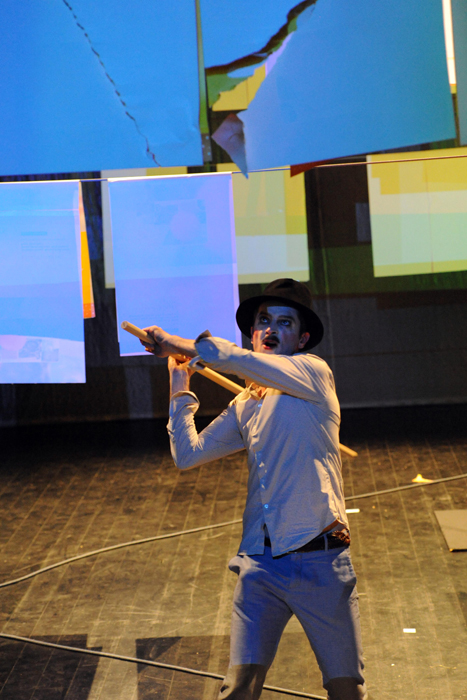
The width and height of the screenshot is (467, 700). I want to click on sheets, so click(x=49, y=280), click(x=96, y=297), click(x=142, y=288), click(x=105, y=276), click(x=256, y=260), click(x=410, y=252).